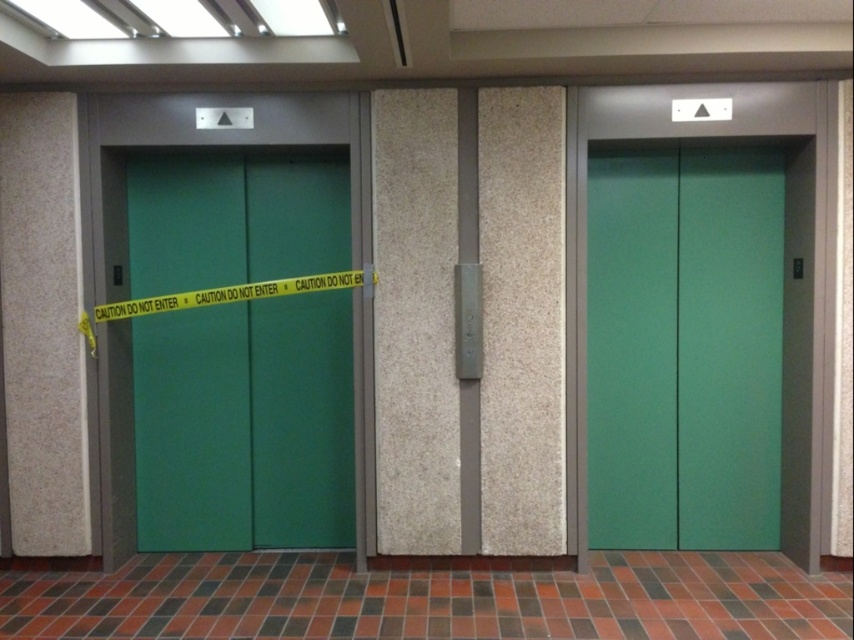
Can you confirm if green matte elevator doors at left is taller than green matte elevator doors at center?

No.

Based on the photo, measure the distance from green matte elevator doors at left to green matte elevator doors at center.

6.19 feet

Is point (174, 548) positioned before point (720, 368)?

No, (174, 548) is behind (720, 368).

Where is `green matte elevator doors at left`? This screenshot has height=640, width=854. green matte elevator doors at left is located at coordinates (244, 424).